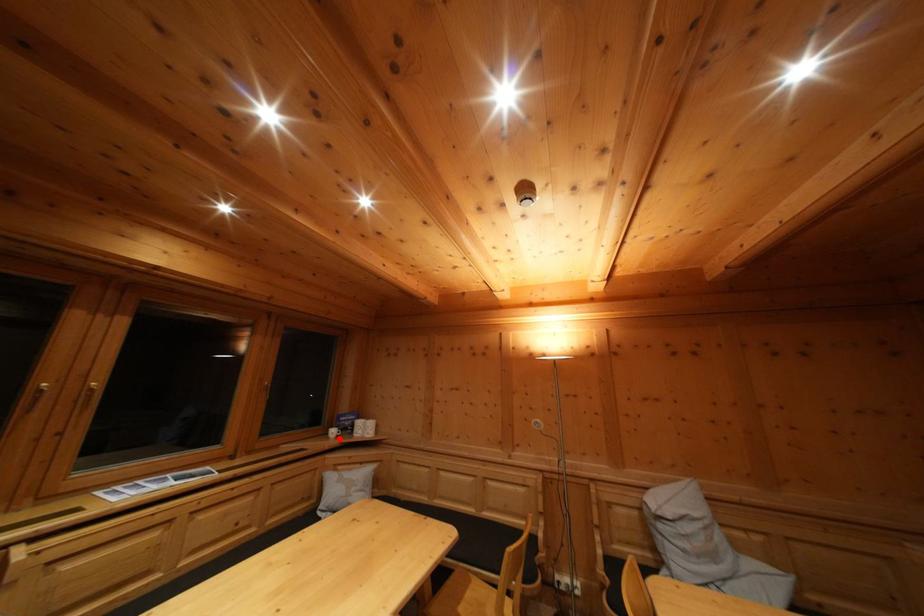
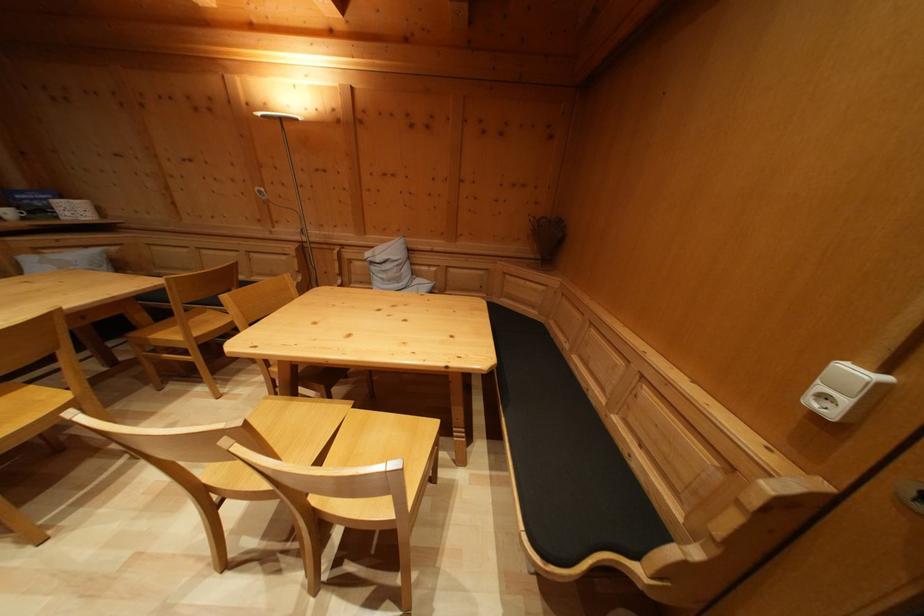
Find the pixel in the second image that matches the highlighted location in the first image.

(14, 219)